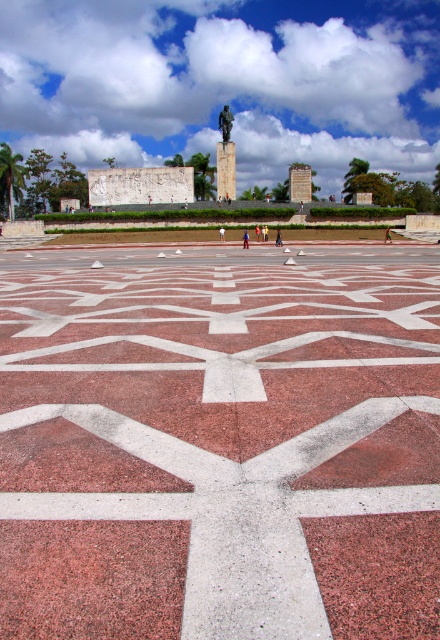
You are standing at the edge of the plaza and want to walk towards the statue in the center. There is a yellow fabric shirt at center and a multicolored fabric person at center blocking your path. Can you walk between them without getting too close? The statue is your final destination. Please consider the distance between them.

The distance between the yellow fabric shirt at center and the multicolored fabric person at center is 19.42 inches. Since this distance is narrow, you might need to carefully step through or go around them to reach the statue without getting too close.

You are standing at the edge of the plaza and see both the green patina statue at center and the yellow fabric shirt at center. If you want to take a photo that includes both objects in the frame, how far apart are they from each other?

The green patina statue at center and the yellow fabric shirt at center are 73.84 feet apart from each other.

You are standing at the entrance of the plaza and want to find the green patina statue at center. According to the map, where should you look relative to your current position?

The green patina statue at center is located at the coordinates point (226, 122), so you should look towards the center of the plaza directly in front of you.